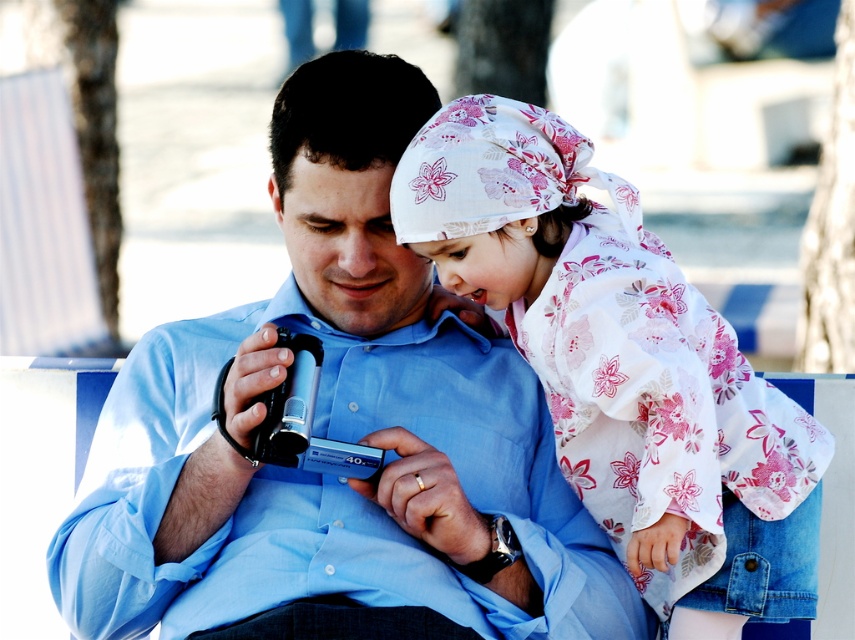
Can you confirm if blue cotton shirt at center is positioned to the right of floral-patterned fabric at upper right?

Incorrect, blue cotton shirt at center is not on the right side of floral-patterned fabric at upper right.

Can you confirm if blue cotton shirt at center is bigger than floral-patterned fabric at upper right?

Yes.

Does point (317, 164) come in front of point (581, 392)?

That is False.

In order to click on blue cotton shirt at center in this screenshot , I will do `click(337, 435)`.